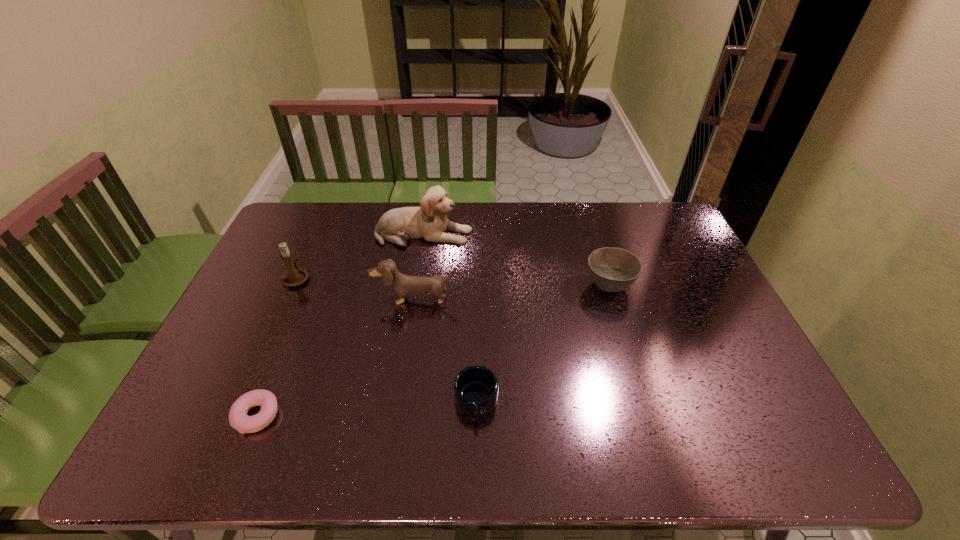
Where is `the taller puppy`? The height and width of the screenshot is (540, 960). the taller puppy is located at coordinates (429, 221).

In order to click on the farthest object in this screenshot , I will do `click(429, 221)`.

The image size is (960, 540). I want to click on candle holder, so click(294, 277).

In order to click on the shorter puppy in this screenshot , I will do `click(403, 285)`.

Image resolution: width=960 pixels, height=540 pixels. In order to click on the rightmost object in this screenshot , I will do `click(612, 269)`.

You are a GUI agent. You are given a task and a screenshot of the screen. Output one action in this format:
    pyautogui.click(x=<x>, y=<y>)
    Task: Click on the third shortest object
    This screenshot has width=960, height=540.
    Given the screenshot: What is the action you would take?
    pyautogui.click(x=612, y=269)

I want to click on the fifth tallest object, so click(476, 388).

This screenshot has width=960, height=540. In order to click on the shortest object in this screenshot , I will do `click(238, 418)`.

The image size is (960, 540). In order to click on blank space located on the front-facing side of the farthest object in this screenshot , I will do `click(583, 234)`.

Find the location of a particular element. The image size is (960, 540). free space located 0.200m on the side of the candle holder with the handle is located at coordinates (318, 230).